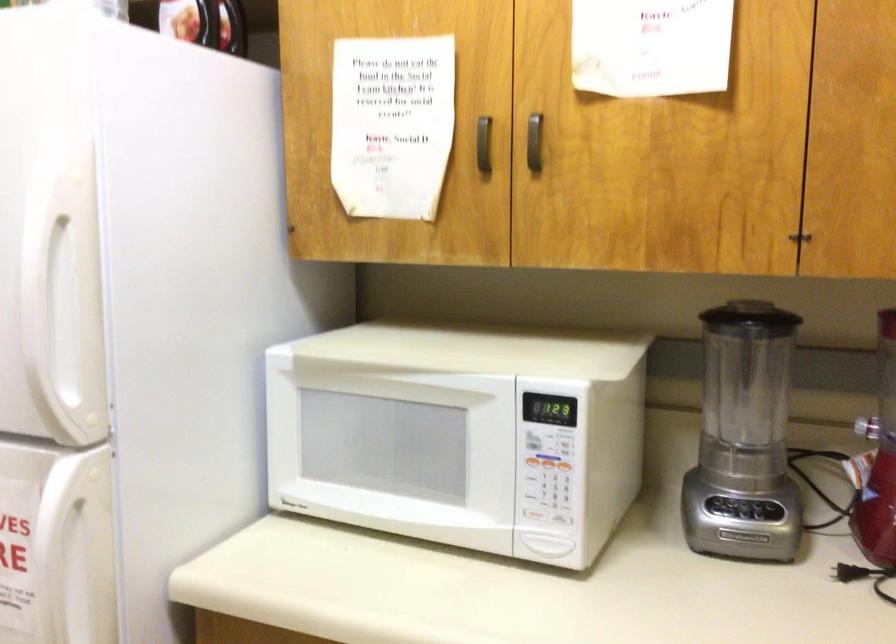
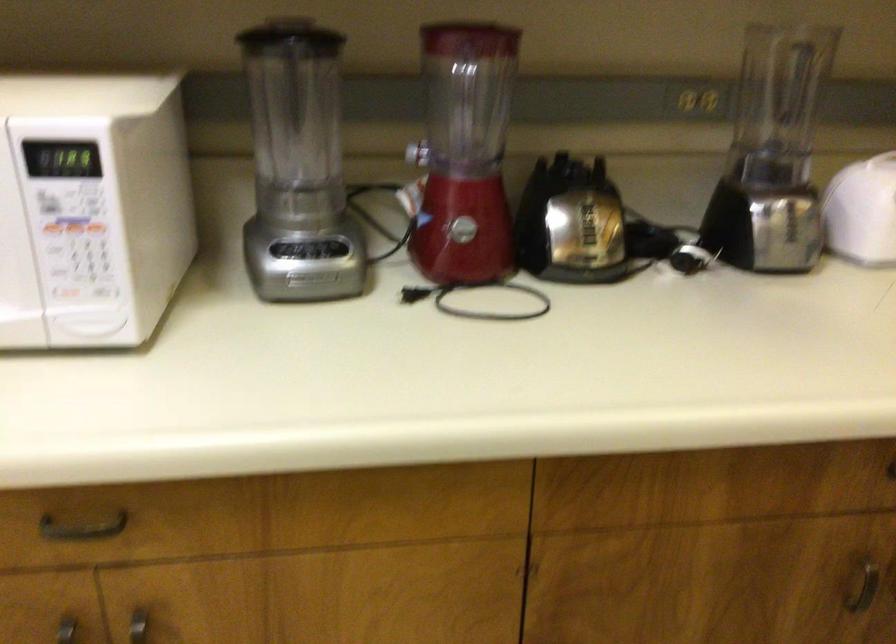
Where in the second image is the point corresponding to point 745,536 from the first image?

(309, 278)